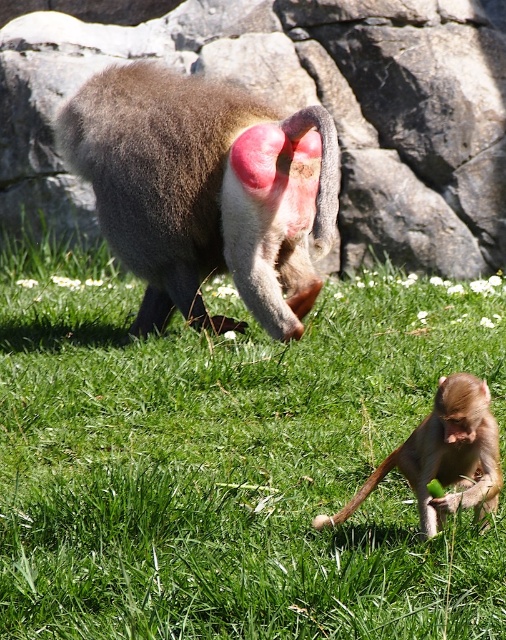
Image resolution: width=506 pixels, height=640 pixels. Identify the location of green grass at center. (231, 461).

Is green grass at center closer to camera compared to light brown fur monkey at lower right?

Yes, it is in front of light brown fur monkey at lower right.

Does point (152, 493) come behind point (476, 449)?

That is True.

Where is `green grass at center`? The height and width of the screenshot is (640, 506). green grass at center is located at coordinates (231, 461).

Does green grass at center have a lesser height compared to gray rock at upper center?

Yes.

Between point (206, 413) and point (63, 13), which one is positioned behind?

Positioned behind is point (63, 13).

Between point (176, 548) and point (462, 38), which one is positioned behind?

The point (462, 38) is behind.

Locate an element on the screen. green grass at center is located at coordinates coord(231,461).

Is green grass at center further to the viewer compared to brown furry monkey at center?

No, green grass at center is closer to the viewer.

The width and height of the screenshot is (506, 640). I want to click on green grass at center, so click(x=231, y=461).

Locate an element on the screen. green grass at center is located at coordinates (231, 461).